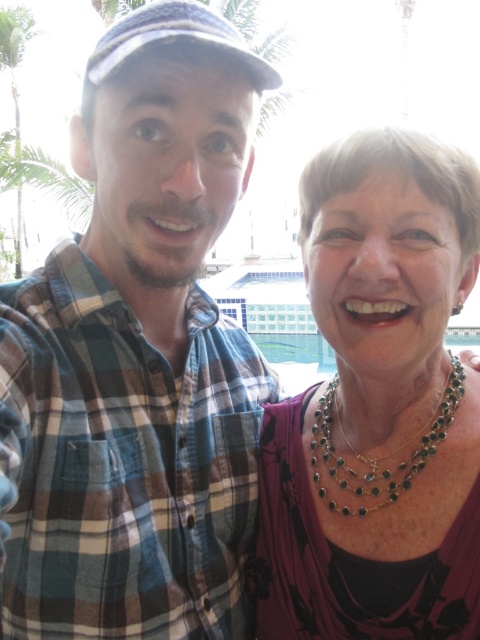
You are a photographer taking a picture of two people standing outdoors. You notice the plaid fabric shirt at left and the multicolored beaded necklace at right. Which object is positioned more to the left side of the image?

The plaid fabric shirt at left is positioned more to the left side of the image than the multicolored beaded necklace at right.

You are a photographer trying to capture a group photo of two people. The two people are standing at point (91, 509). How far apart are they?

They are 5.54 meters apart.

You are a photographer trying to capture a candid shot of the two people in the scene. You want to ensure that both the plaid fabric shirt at left and the green beaded necklace at center are clearly visible in the frame. Based on their positions, which object should you focus on first to ensure both are in focus?

Since the plaid fabric shirt at left is to the left of the green beaded necklace at center, you should focus on the plaid fabric shirt at left first. This way, the depth of field will naturally include the green beaded necklace at center as it is positioned further to the right.